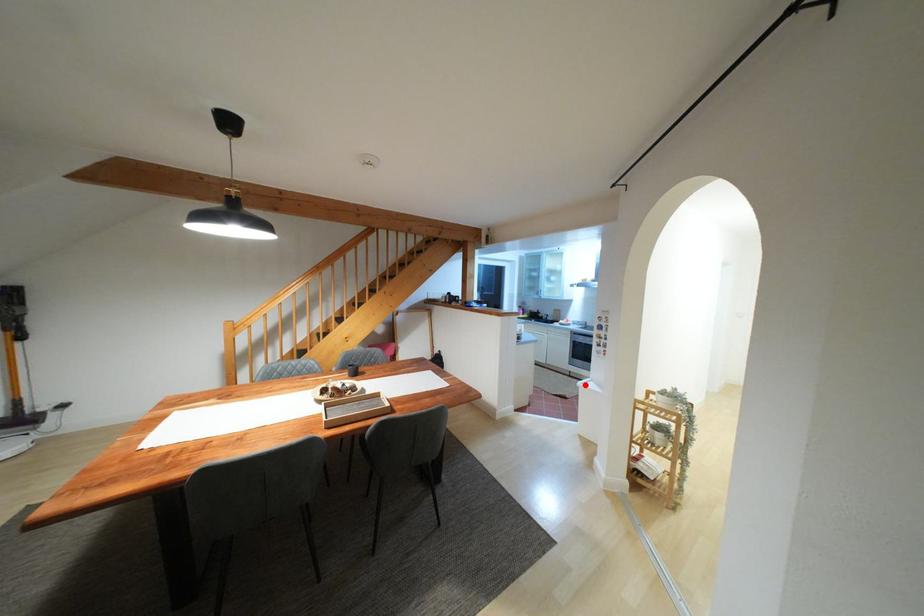
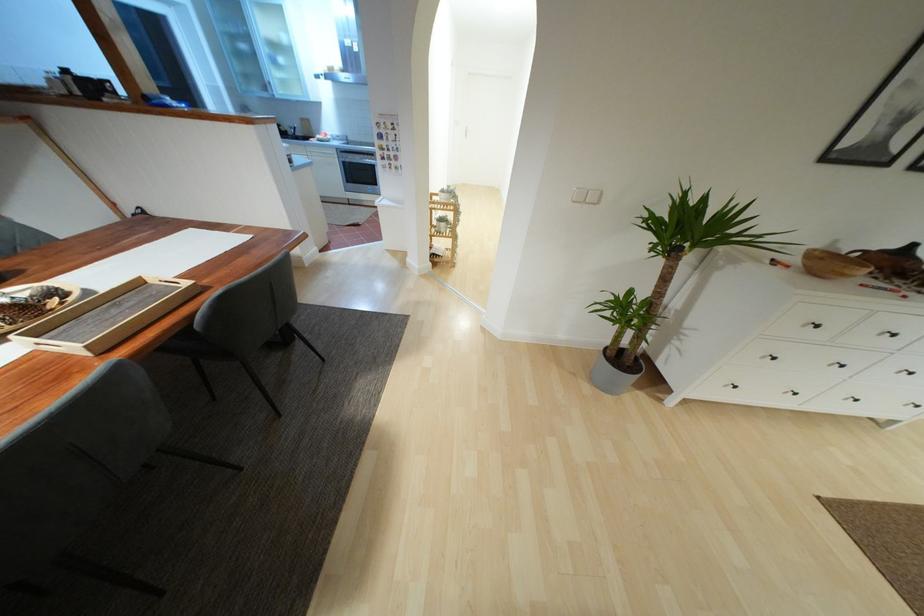
Question: I am providing you with two images of the same scene from different viewpoints. In image1, a red point is highlighted. Considering the same 3D point in image2, which of the following is correct?

Choices:
 (A) It is closer
 (B) It is farther

Answer: (B)